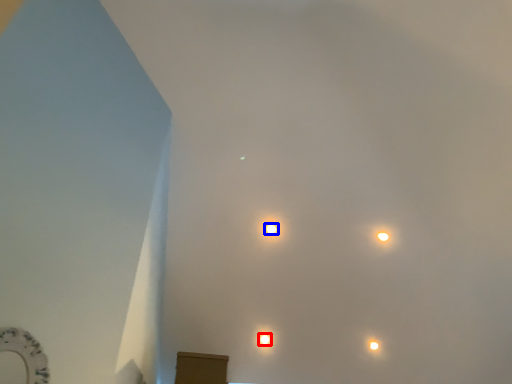
Question: Among these objects, which one is farthest to the camera, lamp (highlighted by a red box) or lamp (highlighted by a blue box)?

Choices:
 (A) lamp
 (B) lamp

Answer: (A)